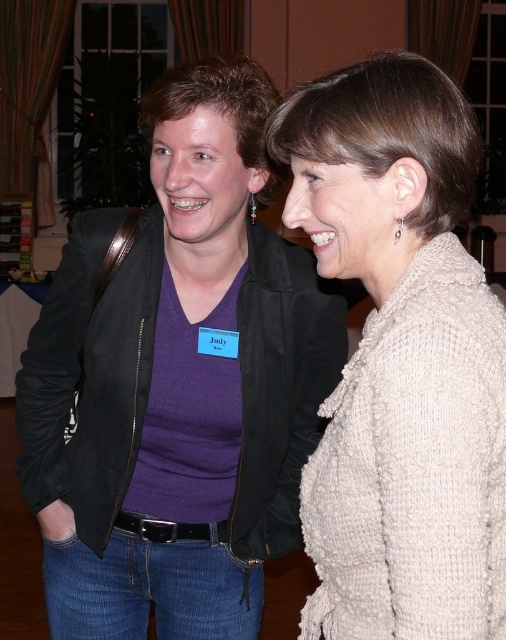
You are a photographer adjusting your camera settings to capture a portrait of Judy and the person in the knitted beige sweater at right. The camera has a focal length of 50mm. To ensure both subjects are in sharp focus, what is the minimum distance you should set the hyperfocal distance? Assume an acceptable circle of confusion is 0.03 mm and an aperture of f8.

The knitted beige sweater at right is 29.76 inches from the camera. Using the hyperfocal distance formula, the minimum distance to set the hyperfocal distance would be calculated to ensure both Judy and the sweater are in focus.

You are standing in a room and see a point marked at coordinates (407, 449). If you want to place a 80 cm long ruler from your current position to that point, will the ruler exactly reach the point?

The distance between you and the point is 79.98 centimeters, so the 80 cm ruler will extend slightly beyond the point when placed from your current position.

You are taking a photo of two people in a room. You notice two points in the image at coordinates point (457, 324) and point (294, 500). Which point is closer to the camera?

Point (457, 324) is closer to the camera than point (294, 500).